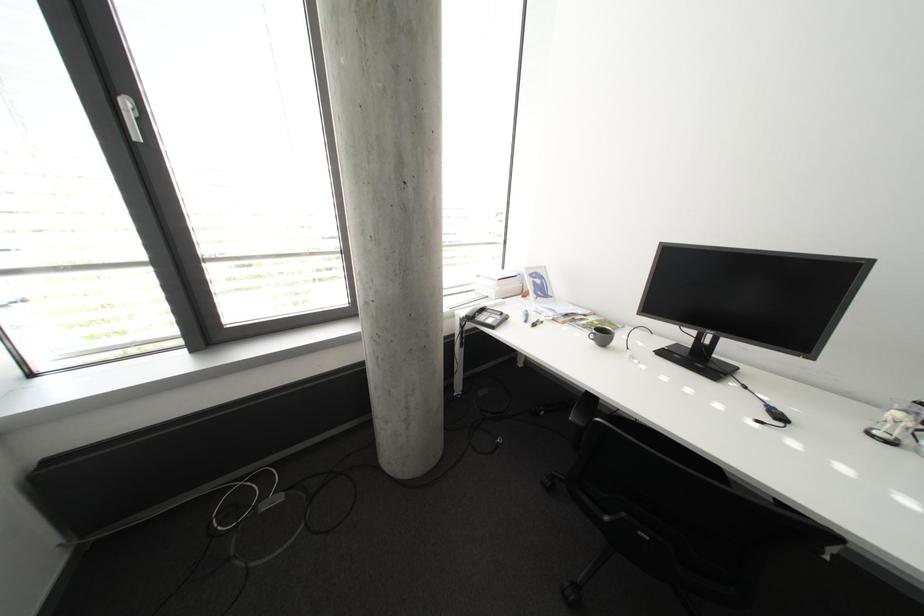
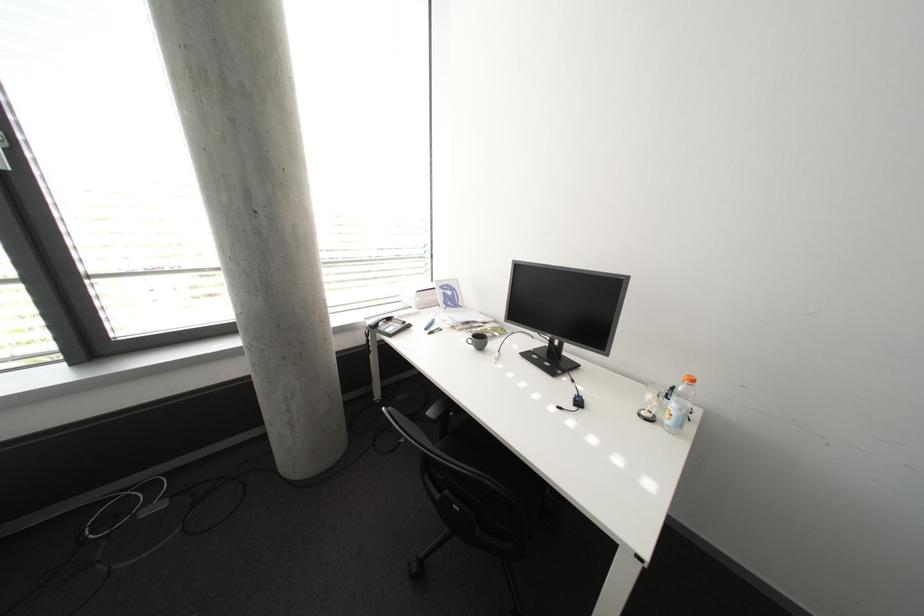
Question: The first image is from the beginning of the video and the second image is from the end. How did the camera likely rotate when shooting the video?

Choices:
 (A) Left
 (B) Right
 (C) Up
 (D) Down

Answer: (B)